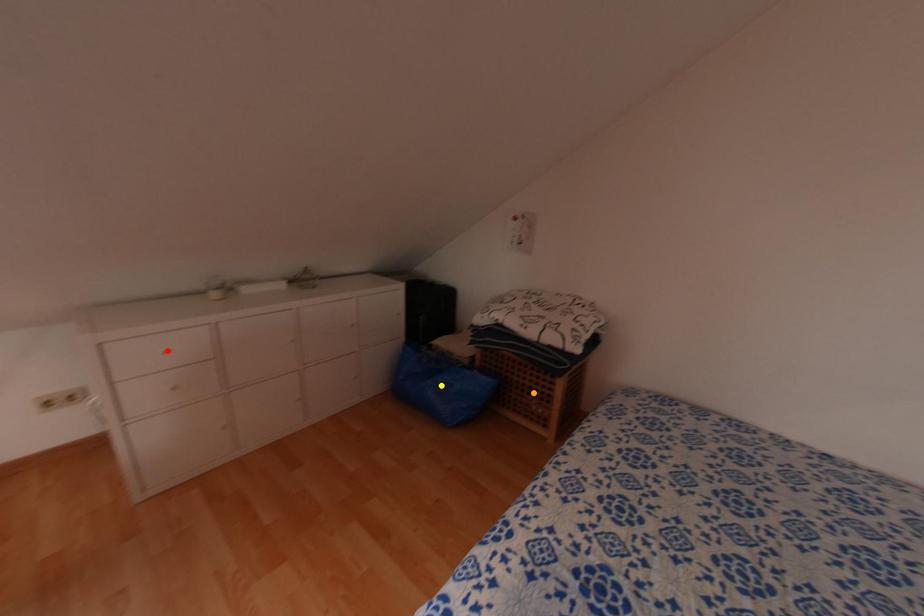
Order these from nearest to farthest:
orange point
red point
yellow point

red point < orange point < yellow point